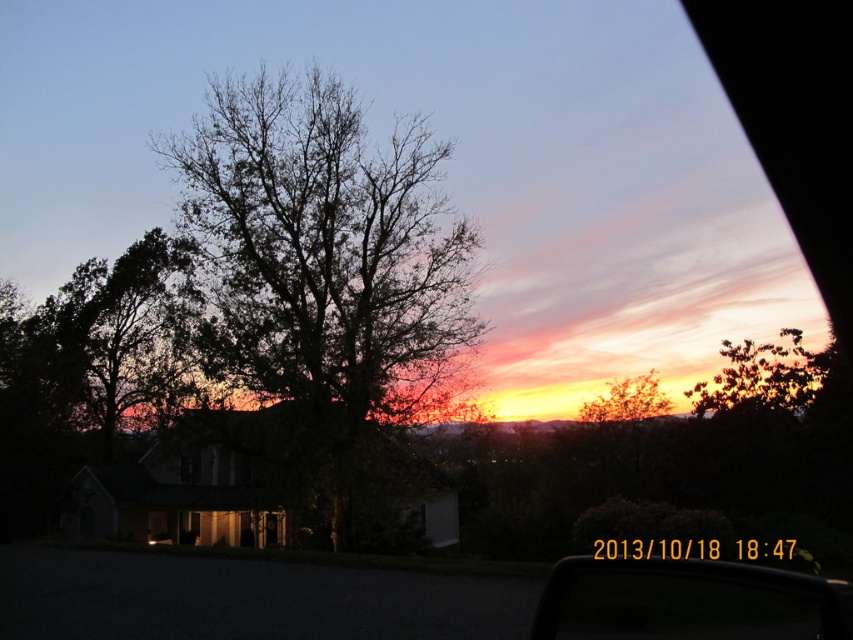
Can you confirm if transparent glass car window at center is bigger than green leafy tree at upper right?

No, transparent glass car window at center is not bigger than green leafy tree at upper right.

Is point (807, 637) positioned behind point (672, 406)?

No, it is not.

Is point (730, 588) farther from camera compared to point (633, 417)?

No.

This screenshot has height=640, width=853. I want to click on transparent glass car window at center, so click(x=688, y=602).

How distant is dark green leafy tree at left from green leafy tree at upper right?

The distance of dark green leafy tree at left from green leafy tree at upper right is 95.50 feet.

Is dark green leafy tree at left wider than green leafy tree at upper right?

Correct, the width of dark green leafy tree at left exceeds that of green leafy tree at upper right.

Which is behind, point (148, 385) or point (645, 392)?

Positioned behind is point (148, 385).

At what (x,y) coordinates should I click in order to perform the action: click on dark green leafy tree at left. Please return your answer as a coordinate pair (x, y). The width and height of the screenshot is (853, 640). Looking at the image, I should click on (111, 336).

Who is taller, dark green leafy tree at center or green leafy tree at upper right?

With more height is dark green leafy tree at center.

In the scene shown: Is dark green leafy tree at center positioned in front of green leafy tree at upper right?

Yes.

Where is `dark green leafy tree at center`? This screenshot has height=640, width=853. dark green leafy tree at center is located at coordinates (323, 262).

I want to click on dark green leafy tree at center, so click(x=323, y=262).